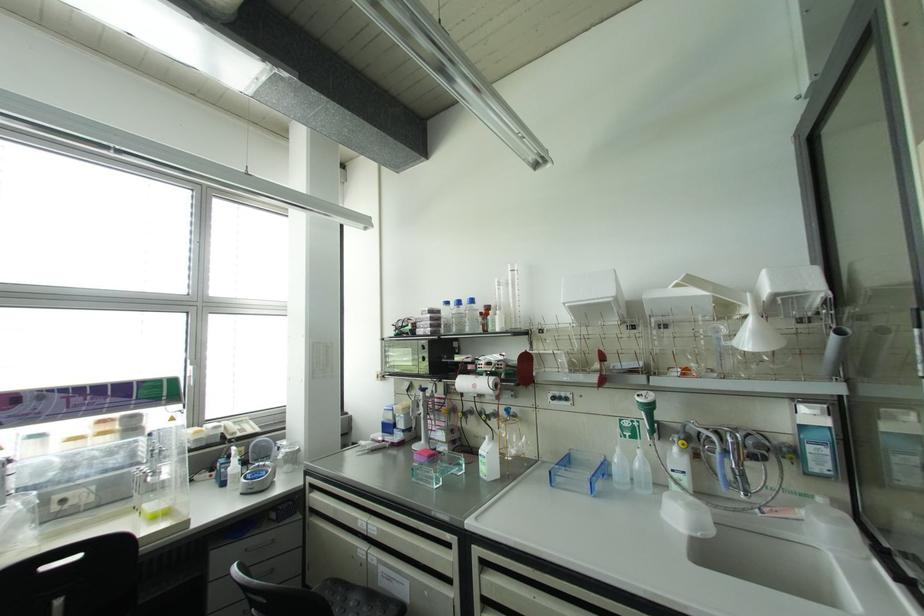
Find the location of a particular element. The height and width of the screenshot is (616, 924). white window handle is located at coordinates (191, 375).